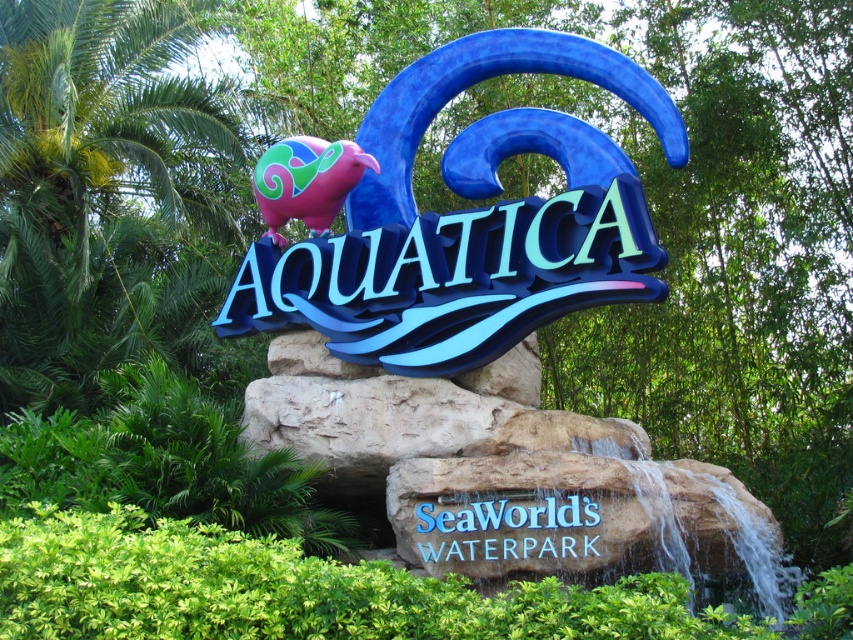
You are standing at the entrance of Aquatica Waterpark and see the glossy plastic sign at center and the blue plastic sign at center. Which one is located higher?

The glossy plastic sign at center is positioned over the blue plastic sign at center, so it is higher.

You are standing at the entrance of Aquatica Waterpark and want to take a photo of the sign. The sign is located at point (396, 275). If your camera has a maximum focus range of 45 meters, will you be able to focus on the sign from your current position?

The point (396, 275) is 44.80 meters away from the viewer. Since the camera can focus up to 45 meters, you can focus on the sign as the distance is within the camera range.

You are standing at the entrance of Aquatica Waterpark and see the glossy plastic sign at center and the blue plastic sign at center. If you want to place a new decorative flag between them, how far apart should you position the flag from each sign to maintain equal distance?

The glossy plastic sign at center and blue plastic sign at center are 12.46 meters apart from each other. To place the flag equidistant between them, position it 6.23 meters away from each sign.